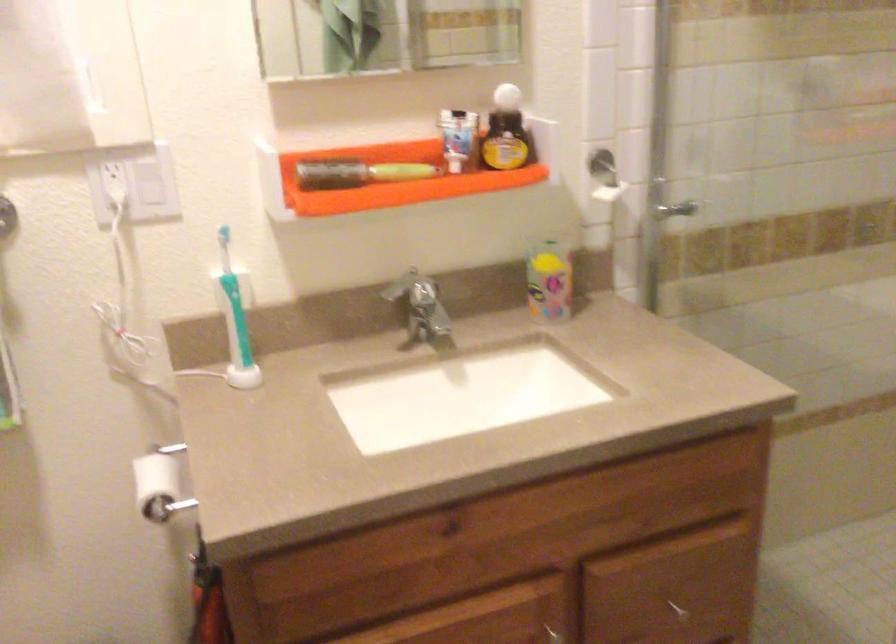
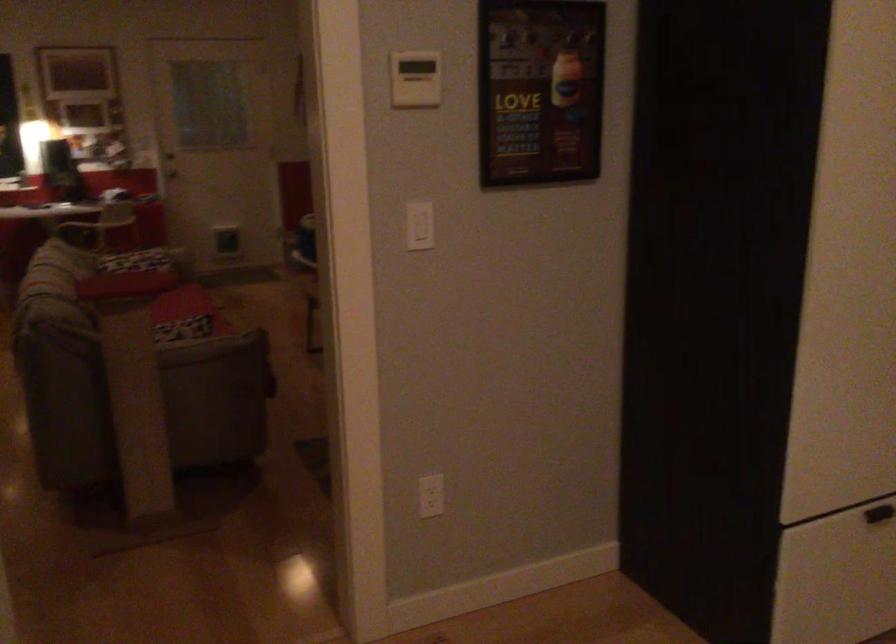
Question: The camera is either moving clockwise (left) or counter-clockwise (right) around the object. The first image is from the beginning of the video and the second image is from the end. Is the camera moving left or right when shooting the video?

Choices:
 (A) Left
 (B) Right

Answer: (A)